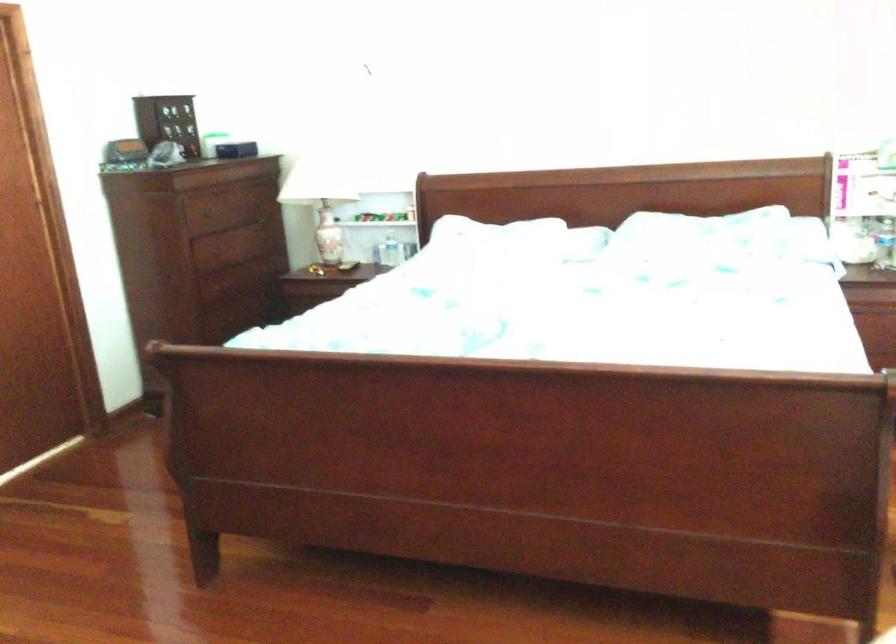
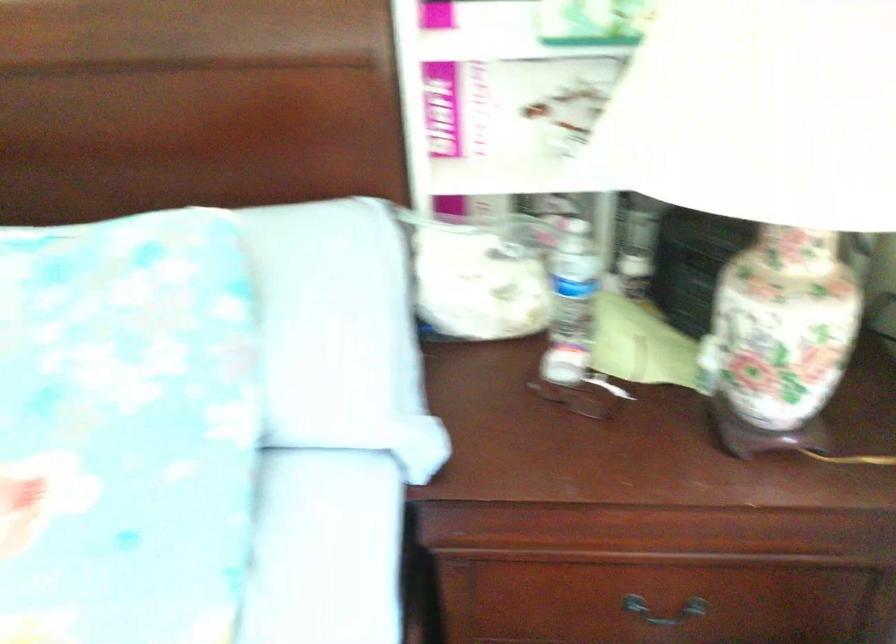
Which direction would the cameraman need to move to produce the second image?

The movement direction of the cameraman is right, forward.